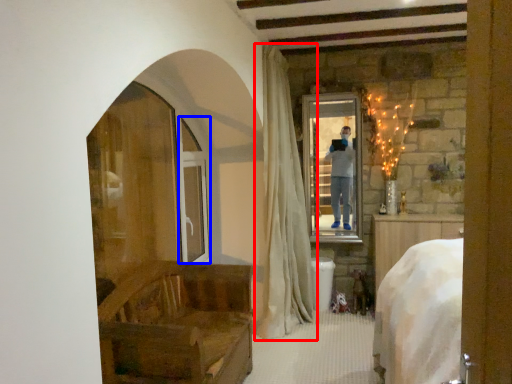
Question: Which point is further to the camera, curtain (highlighted by a red box) or screen door (highlighted by a blue box)?

Choices:
 (A) curtain
 (B) screen door

Answer: (B)